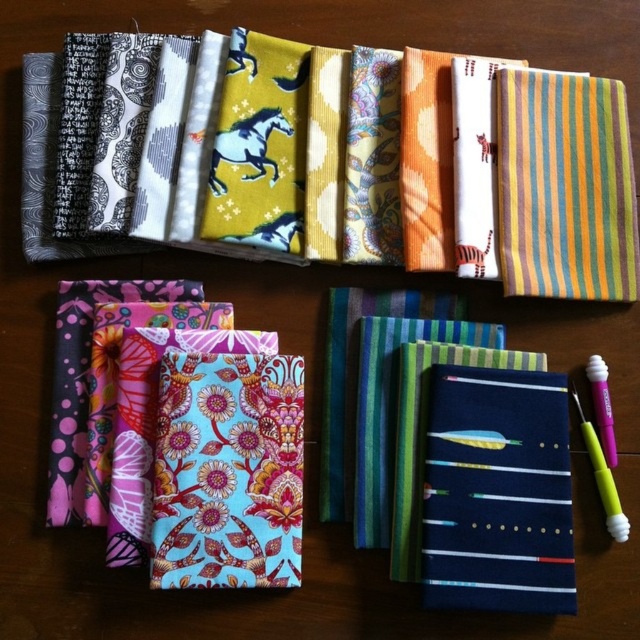
In the scene shown: You are an interior designer who needs to choose between the navy blue fabric at center and the translucent purple pen at lower right for a project. Since you want the item with the larger width, which one should you select?

The navy blue fabric at center has a greater width than the translucent purple pen at lower right, so you should select the navy blue fabric at center.